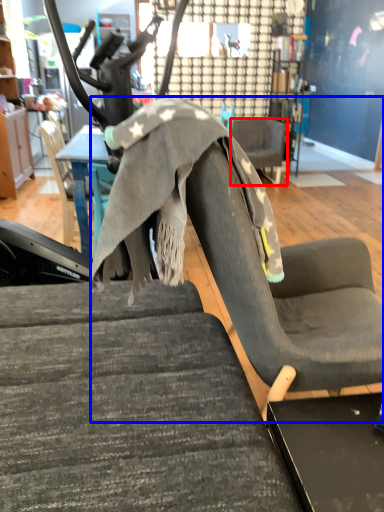
Question: Which point is closer to the camera, chair (highlighted by a red box) or swivel chair (highlighted by a blue box)?

Choices:
 (A) chair
 (B) swivel chair

Answer: (B)